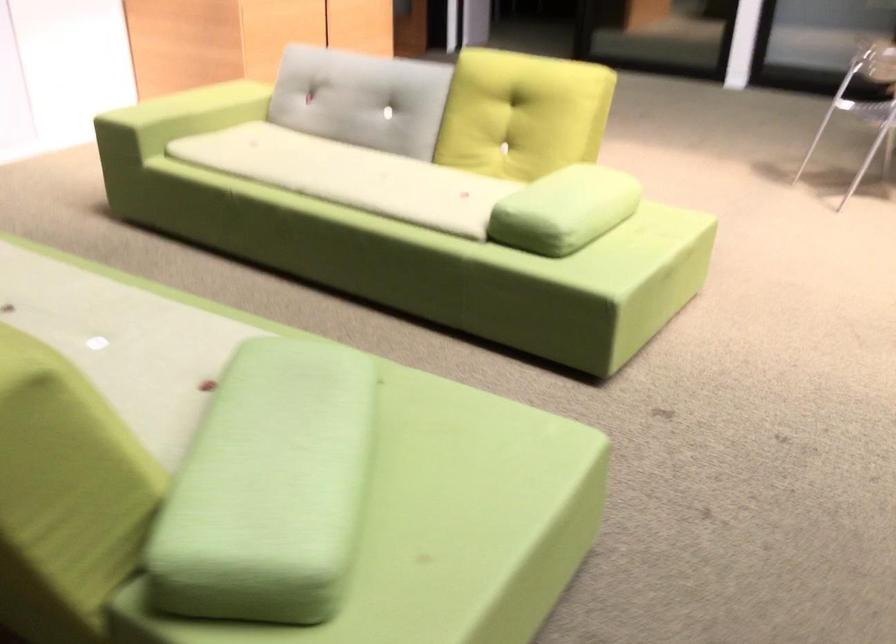
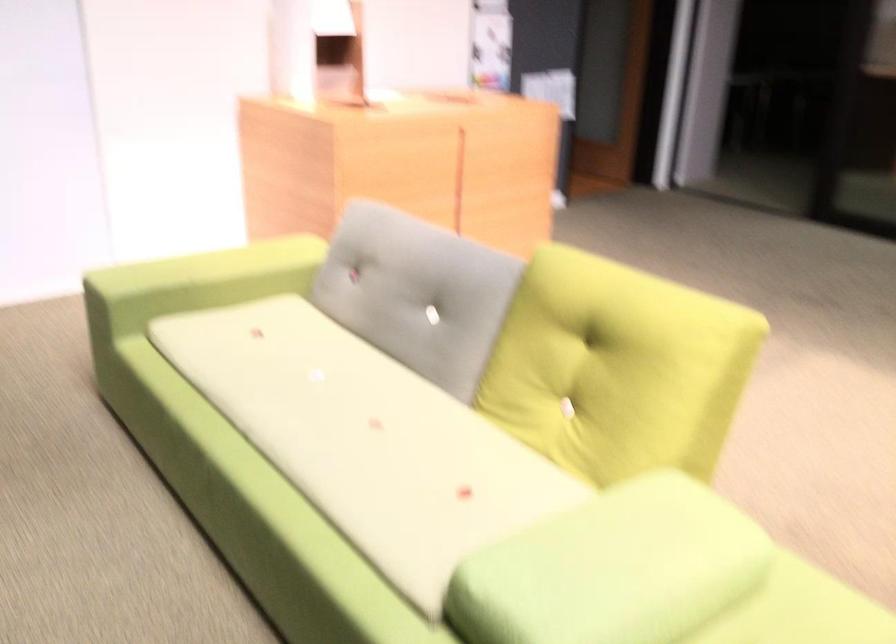
Locate, in the second image, the point that corresponds to point 533,106 in the first image.

(616, 368)